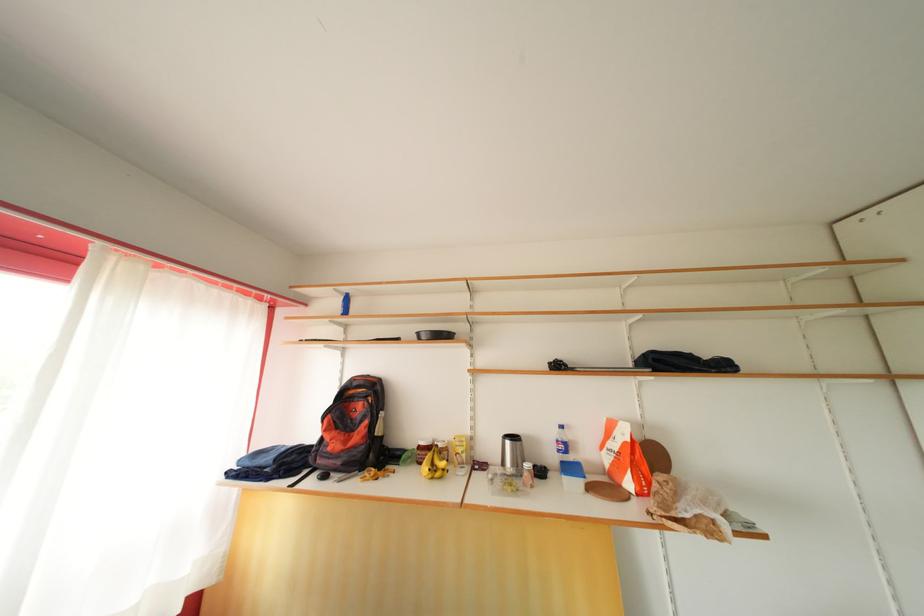
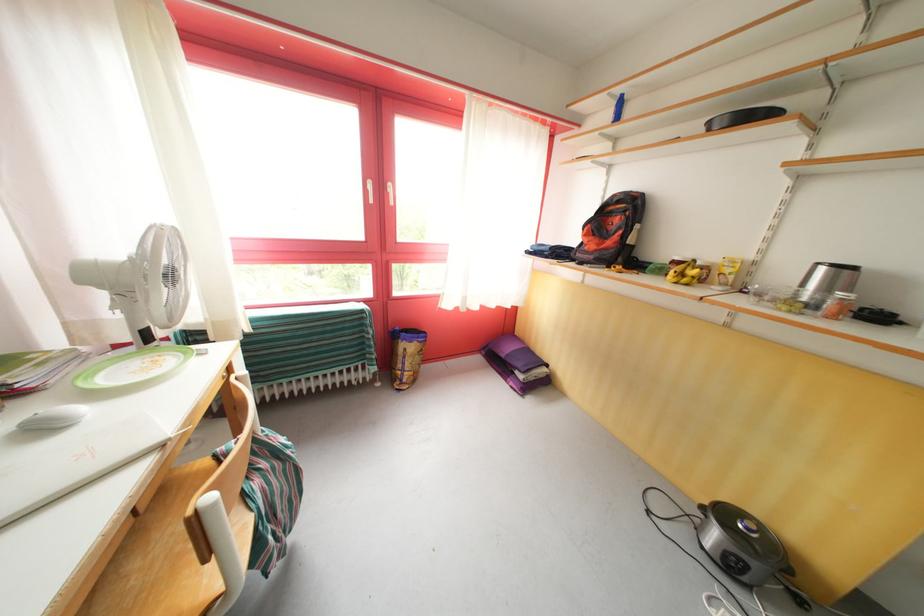
Where in the second image is the point corresponding to [430,448] from the first image?

(684, 264)